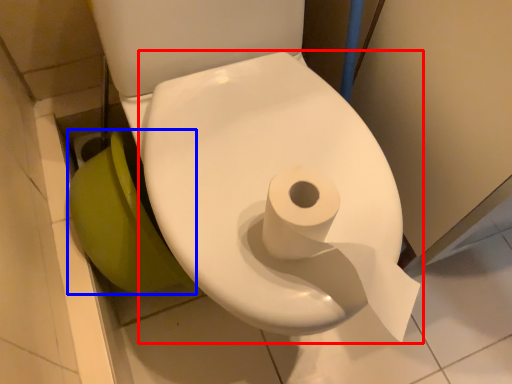
Question: Which object appears closest to the camera in this image, toilet (highlighted by a red box) or toilet bowl (highlighted by a blue box)?

Choices:
 (A) toilet
 (B) toilet bowl

Answer: (A)